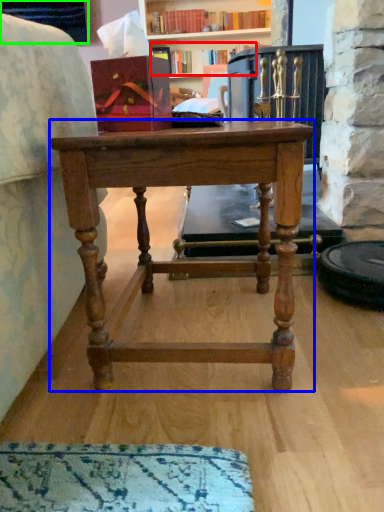
Question: Considering the real-world distances, which object is farthest from book (highlighted by a red box)? desk (highlighted by a blue box) or cabinetry (highlighted by a green box)?

Choices:
 (A) desk
 (B) cabinetry

Answer: (A)